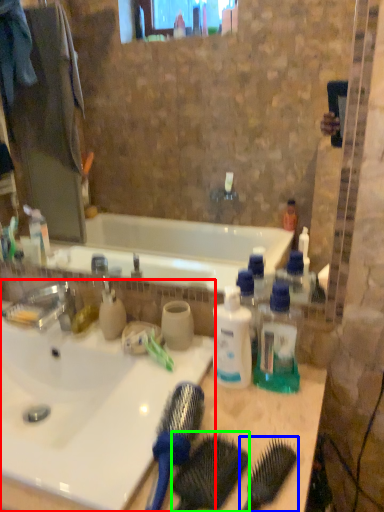
Question: Which object is the farthest from sink (highlighted by a red box)? Choose among these: brush (highlighted by a blue box) or comb (highlighted by a green box).

Choices:
 (A) brush
 (B) comb

Answer: (A)